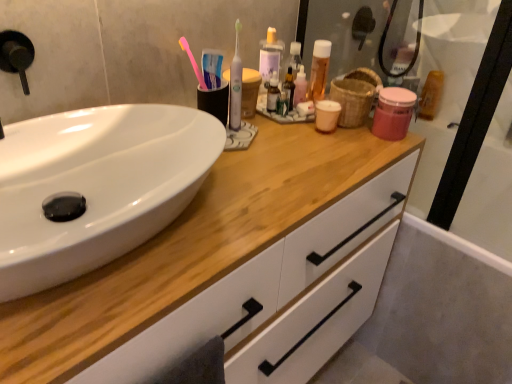
I want to click on free location to the left of pink matte jar at upper right, which is the 1th mouthwash in front-to-back order, so click(329, 142).